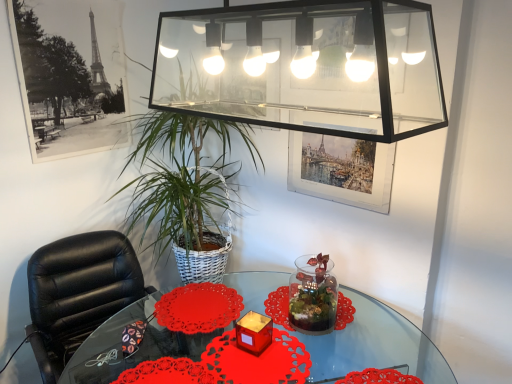
This screenshot has width=512, height=384. I want to click on free location to the left of translucent glass candle at center, so click(x=214, y=351).